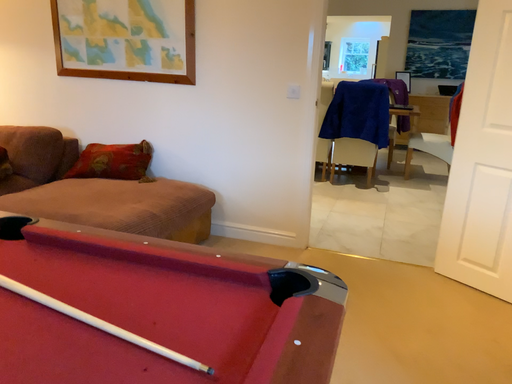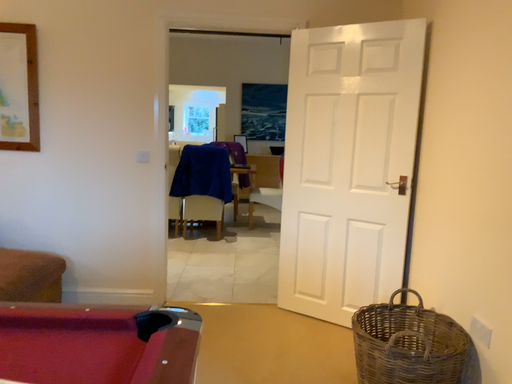
Question: Which way did the camera rotate in the video?

Choices:
 (A) rotated left
 (B) rotated right

Answer: (B)